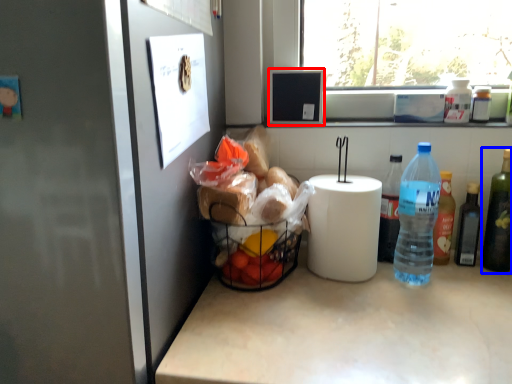
Question: Which object appears closest to the camera in this image, appliance (highlighted by a red box) or bottle (highlighted by a blue box)?

Choices:
 (A) appliance
 (B) bottle

Answer: (B)